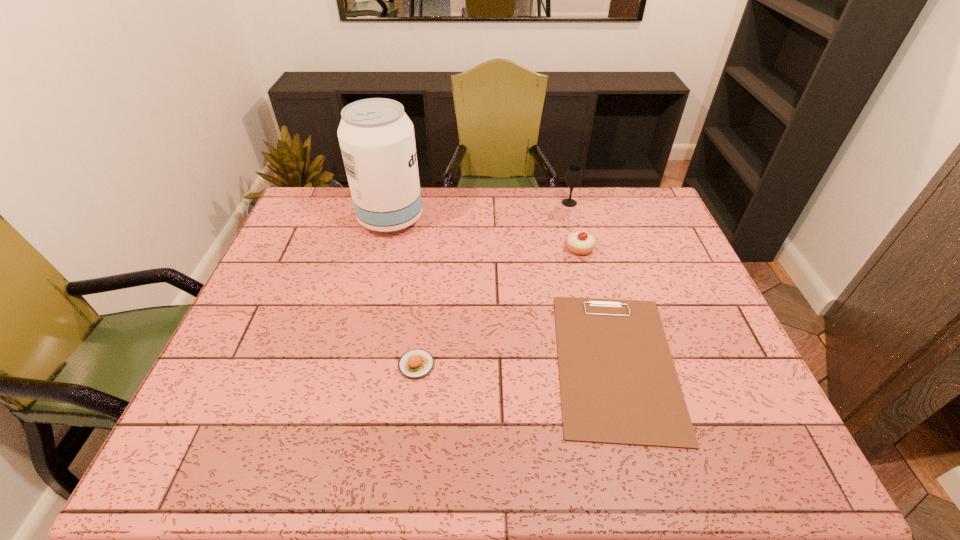
Locate an element on the screen. The image size is (960, 540). the tallest object is located at coordinates (376, 137).

Where is `the second tallest object`? This screenshot has height=540, width=960. the second tallest object is located at coordinates (573, 176).

I want to click on the third shortest object, so click(578, 242).

You are a GUI agent. You are given a task and a screenshot of the screen. Output one action in this format:
    pyautogui.click(x=<x>, y=<y>)
    Task: Click on the food
    This screenshot has height=540, width=960.
    Given the screenshot: What is the action you would take?
    pyautogui.click(x=416, y=363)

You are a GUI agent. You are given a task and a screenshot of the screen. Output one action in this format:
    pyautogui.click(x=<x>, y=<y>)
    Task: Click on the shortest object
    This screenshot has width=960, height=540.
    Given the screenshot: What is the action you would take?
    pyautogui.click(x=618, y=382)

The image size is (960, 540). Identify the location of free space located on the left of the alcohol. tap(318, 219).

This screenshot has width=960, height=540. In order to click on free space located 0.360m on the left of the second tallest object in this screenshot , I will do `click(461, 203)`.

This screenshot has height=540, width=960. Identify the location of free space located 0.260m on the front of the pastry. (598, 323).

You are a GUI agent. You are given a task and a screenshot of the screen. Output one action in this format:
    pyautogui.click(x=<x>, y=<y>)
    Task: Click on the vacant position located 0.050m on the left of the food
    
    Given the screenshot: What is the action you would take?
    pyautogui.click(x=378, y=364)

Identify the location of vacant space located on the back of the shortest object. (578, 219).